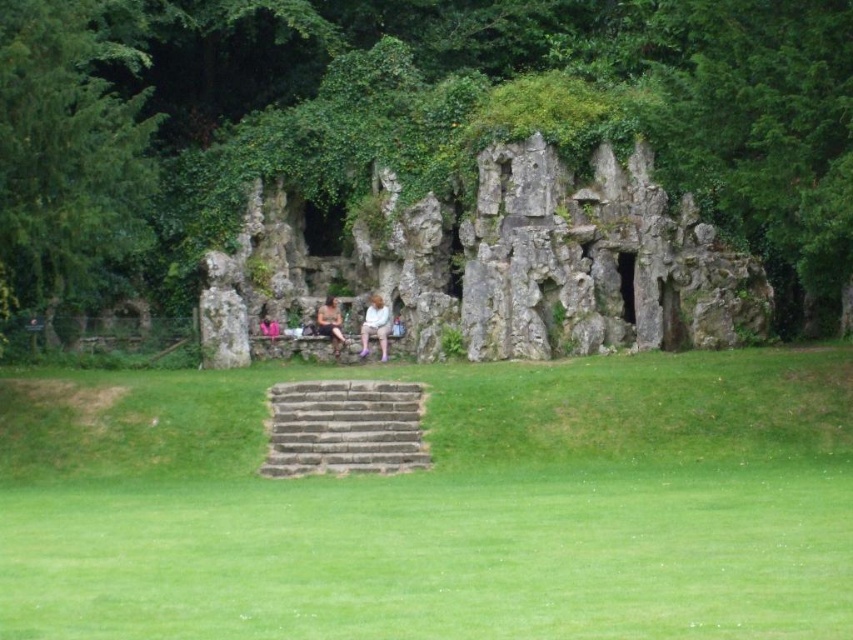
Based on the coordinates provided in the description, where is the green leafy tree at upper center located in the image?

The green leafy tree at upper center is located at point coordinates of 0.186 on the x axis and 0.475 on the y axis.

You are standing at the point marked by the coordinates (503, 264) in the image. Based on the scene described, what object are you directly positioned on?

You are directly positioned on the natural stone rock formation at center, as the point (503, 264) marks this location in the scene.

You are standing at the base of the rock formation and want to walk to the matte white dress at center. There is a green leafy tree at upper center in the way. Will you have to walk around the tree to reach the dress?

The distance between the green leafy tree at upper center and the matte white dress at center is 8.07 meters, so you would not need to walk around the tree to reach the dress as it is not blocking your path.